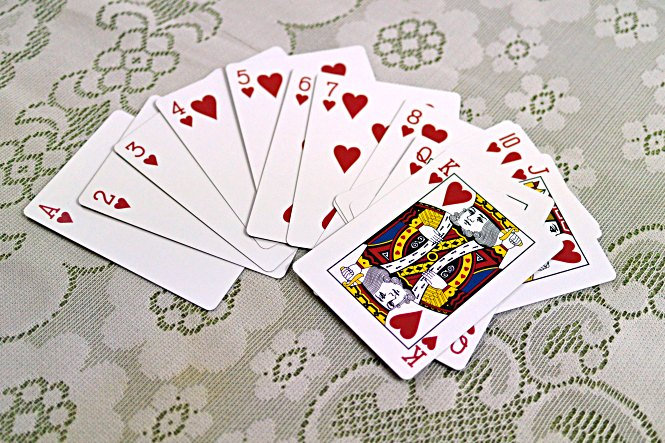
Locate an element on the screen. tablecloth background is located at coordinates (604, 61), (76, 384), (590, 395), (12, 57).